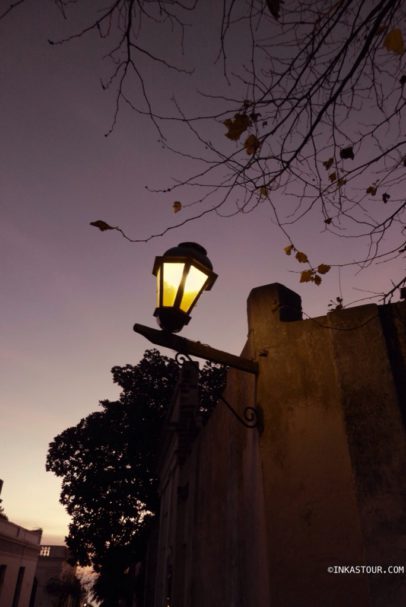
Where is `glass`? This screenshot has height=607, width=406. glass is located at coordinates (156, 286), (172, 274), (192, 283).